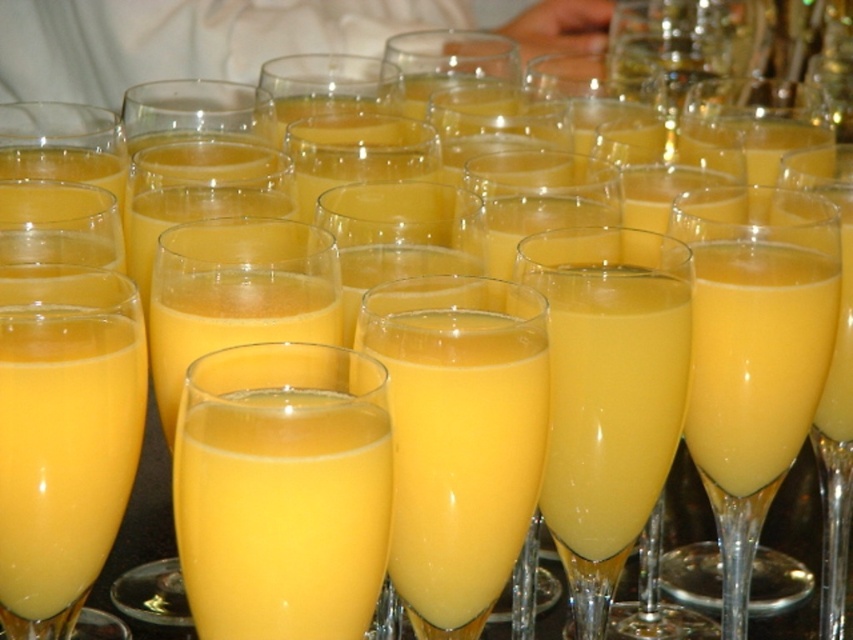
Identify the location of translucent glass flute at center. The width and height of the screenshot is (853, 640). (753, 353).

Does translucent glass flute at center have a lesser width compared to yellow translucent glass at center?

Incorrect, translucent glass flute at center's width is not less than yellow translucent glass at center's.

Is point (808, 268) positioned behind point (48, 515)?

Yes, it is.

I want to click on translucent glass flute at center, so click(753, 353).